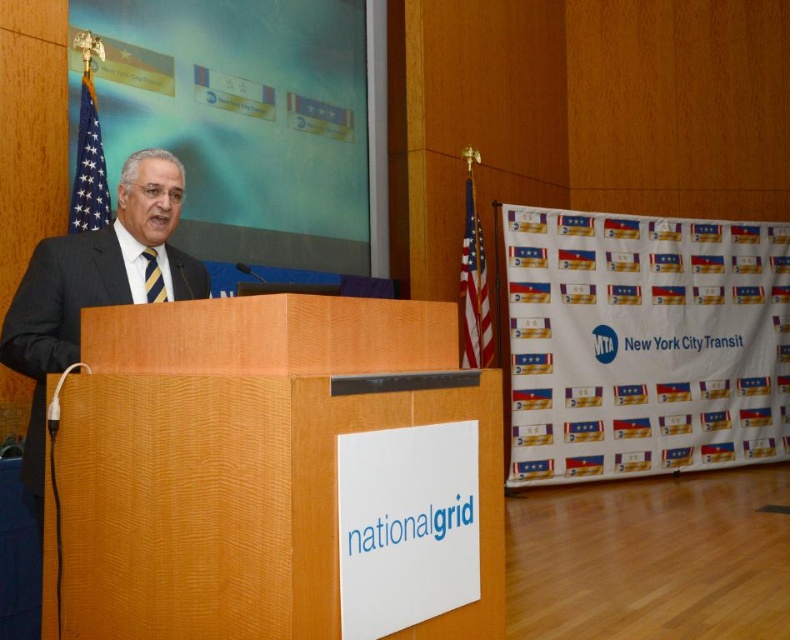
Question: Which object is positioned farthest from the polished wood flag at right?

Choices:
 (A) matte black flag at upper left
 (B) wooden podium at center

Answer: (B)

Question: Can you confirm if wooden podium at center is thinner than striped silk tie at left?

Choices:
 (A) yes
 (B) no

Answer: (B)

Question: Which is nearer to the dark suit at left?

Choices:
 (A) striped silk tie at left
 (B) matte black flag at upper left

Answer: (A)

Question: Estimate the real-world distances between objects in this image. Which object is farther from the dark suit at left?

Choices:
 (A) polished wood flag at right
 (B) matte black flag at upper left

Answer: (A)

Question: Is the position of polished wood flag at right less distant than that of striped silk tie at left?

Choices:
 (A) no
 (B) yes

Answer: (A)

Question: Is wooden podium at center above striped silk tie at left?

Choices:
 (A) yes
 (B) no

Answer: (B)